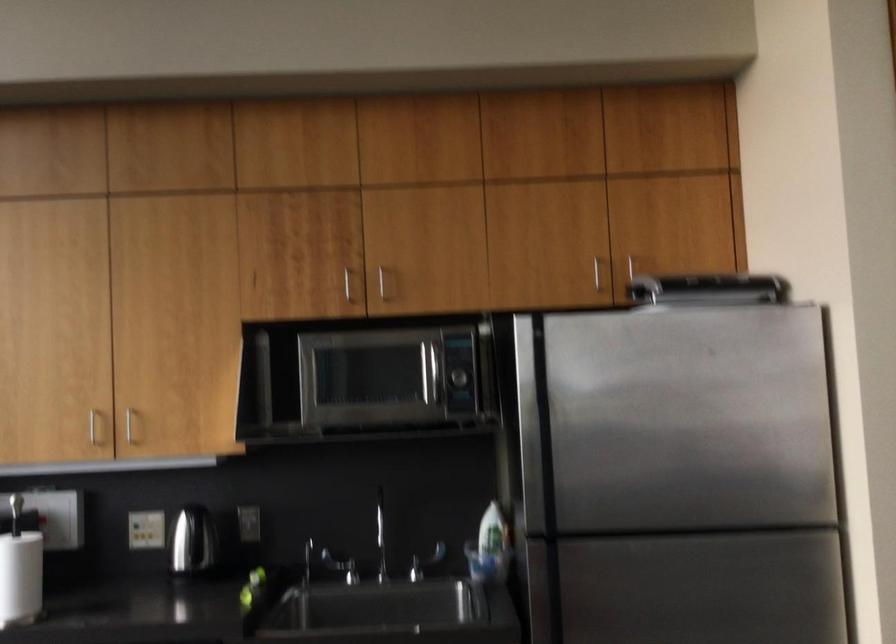
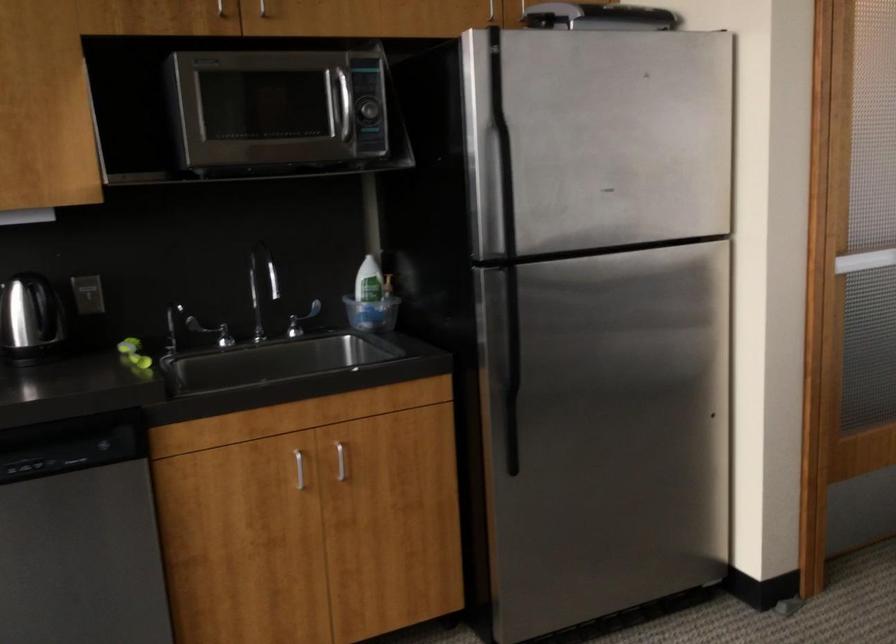
What movement of the cameraman would produce the second image?

The movement direction of the cameraman is left, forward.